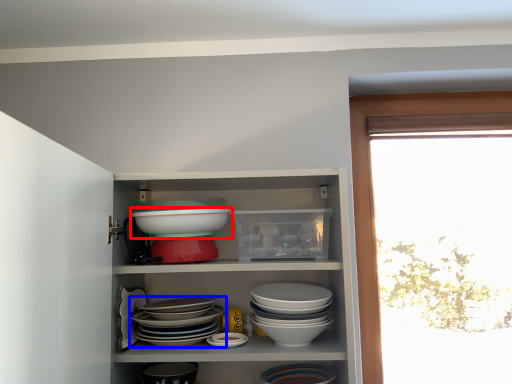
Question: Which object appears farthest to the camera in this image, bowl (highlighted by a red box) or bowl (highlighted by a blue box)?

Choices:
 (A) bowl
 (B) bowl

Answer: (A)